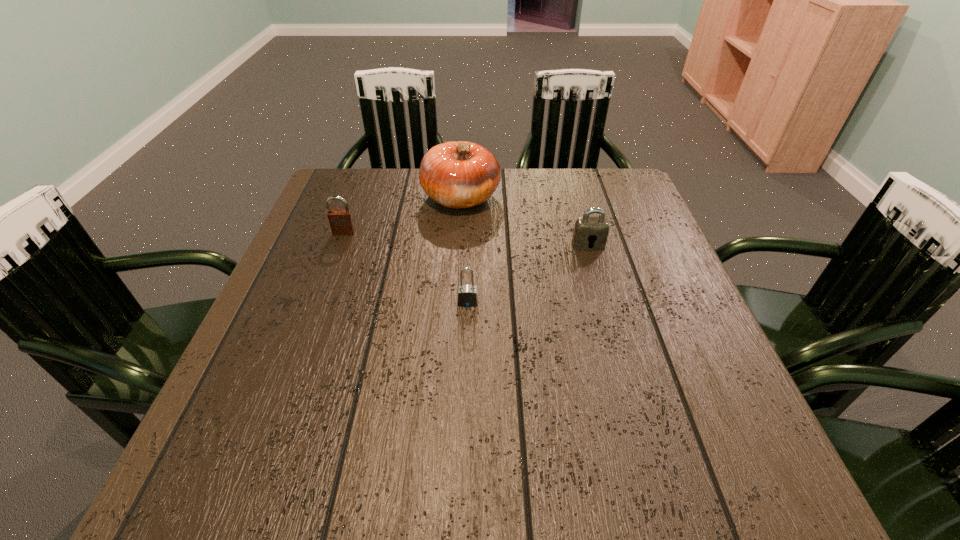
Find the location of a particular element. pumpkin is located at coordinates (459, 174).

The image size is (960, 540). What are the coordinates of `the tallest object` in the screenshot? It's located at (459, 174).

Locate an element on the screen. The image size is (960, 540). the rightmost object is located at coordinates (590, 233).

I want to click on the rightmost padlock, so (590, 233).

The width and height of the screenshot is (960, 540). Identify the location of the leftmost object. (341, 222).

Locate an element on the screen. The image size is (960, 540). the farthest padlock is located at coordinates (341, 222).

Image resolution: width=960 pixels, height=540 pixels. Find the location of `the nearest padlock`. the nearest padlock is located at coordinates (467, 296).

Find the location of a particular element. The image size is (960, 540). the second padlock from left to right is located at coordinates (467, 296).

Identify the location of free point located 0.170m on the left of the farthest object. (361, 198).

You are a GUI agent. You are given a task and a screenshot of the screen. Output one action in this format:
    pyautogui.click(x=<x>, y=<y>)
    Task: Click on the vacant area located 0.280m at the front of the rightmost padlock near the keyhole
    The image size is (960, 540).
    Given the screenshot: What is the action you would take?
    pyautogui.click(x=616, y=343)